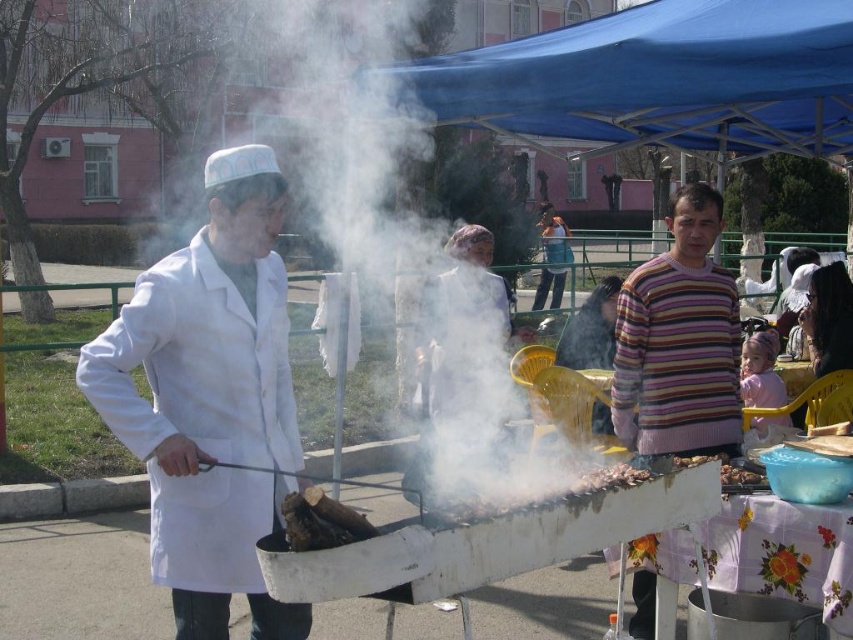
Consider the image. You are standing in the outdoor cooking area and want to reach the point marked at coordinates (822, 298). The grill is between you and this point. Can you walk around the grill to reach it?

The point marked at coordinates (822, 298) is 6.29 meters away from you, so you can walk around the grill to reach it since the distance allows for maneuvering around the obstacle.

You are a photographer at the event and want to capture a closeup of the white matte lab coat at left. Based on its position, where should you aim your camera?

The white matte lab coat at left is located at coordinates point 0.625 on the x axis and 0.247 on the y axis, so you should aim your camera at that point to capture it.

You are a visitor at the event and want to take a photo of the white matte lab coat at left and the blue fabric canopy at upper center. Which object should you focus on first if you want to capture both in the same frame without moving the camera?

The white matte lab coat at left is taller than the blue fabric canopy at upper center, so you should focus on the white matte lab coat at left first to ensure both are in frame.